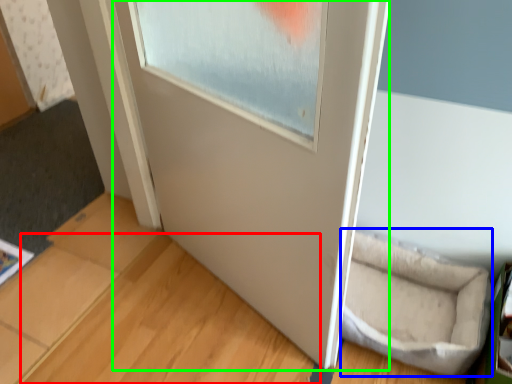
Question: Which is nearer to the wood (highlighted by a red box)? wide (highlighted by a blue box) or door (highlighted by a green box).

Choices:
 (A) wide
 (B) door

Answer: (B)